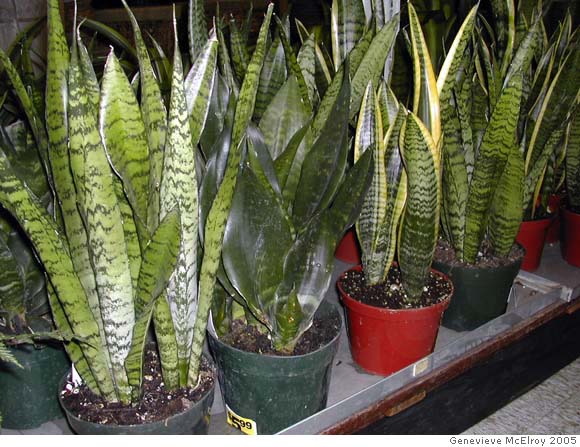
What are the coordinates of `snake plant` in the screenshot? It's located at (119, 198), (259, 185), (403, 158), (480, 151), (543, 152), (569, 138).